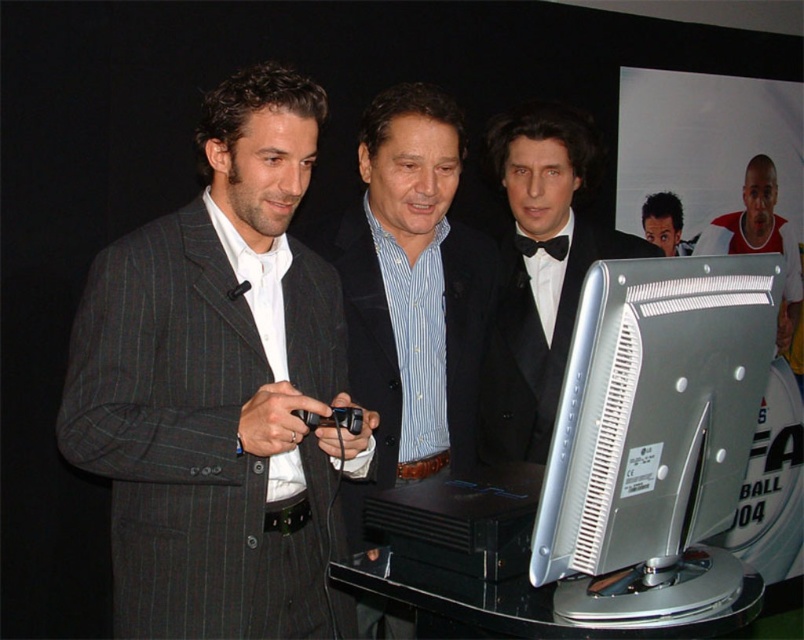
You are a photographer at an event and need to adjust the lighting so that the silver metallic computer monitor at right and the black satin tuxedo at right are both well lit. Which object should you move closer to the light source to ensure proper exposure?

The silver metallic computer monitor at right should be moved closer to the light source because it is positioned on the left side of the black satin tuxedo at right, so moving it closer will help balance the lighting between both objects.

You are a photographer at an event and need to position yourself to capture both the gray pinstripe suit at left and the dark brown hair at center in the same frame. Based on their positions, which subject should you focus on first to ensure both are in the frame?

The gray pinstripe suit at left is located below dark brown hair at center. To capture both in the same frame, focus on the dark brown hair at center first as it is higher up, allowing the lower positioned gray pinstripe suit at left to still be within the frame.